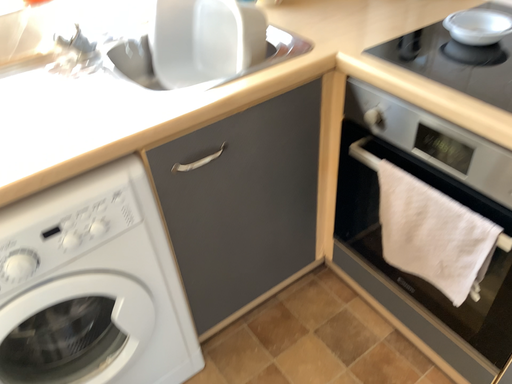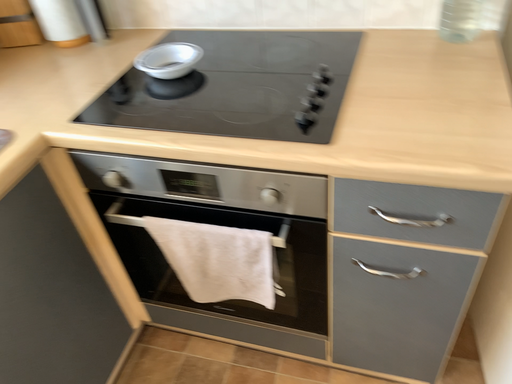
Question: Which way did the camera rotate in the video?

Choices:
 (A) rotated left
 (B) rotated right

Answer: (B)